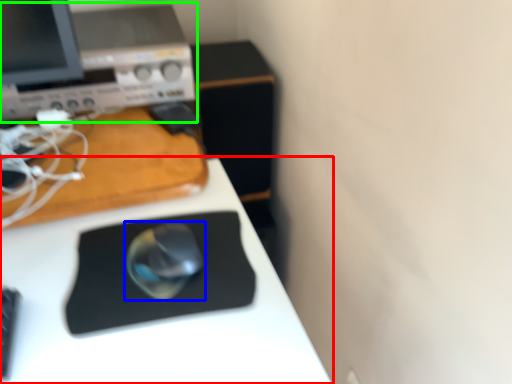
Question: Estimate the real-world distances between objects in this image. Which object is farther from desk (highlighted by a red box), mouse (highlighted by a blue box) or desktop computer (highlighted by a green box)?

Choices:
 (A) mouse
 (B) desktop computer

Answer: (B)